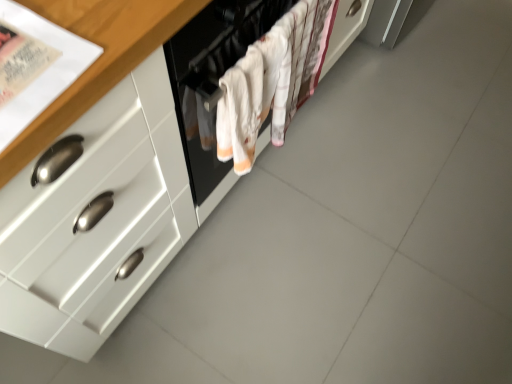
Question: Is white fabric oven at center spatially inside white glossy cabinet at center, or outside of it?

Choices:
 (A) outside
 (B) inside

Answer: (A)

Question: From their relative heights in the image, would you say white fabric oven at center is taller or shorter than white glossy cabinet at center?

Choices:
 (A) tall
 (B) short

Answer: (B)

Question: Considering their positions, is white fabric oven at center located in front of or behind white glossy cabinet at center?

Choices:
 (A) behind
 (B) front

Answer: (A)

Question: Considering the positions of point coord(66,205) and point coord(176,48), is point coord(66,205) closer or farther from the camera than point coord(176,48)?

Choices:
 (A) closer
 (B) farther

Answer: (A)

Question: Is white glossy cabinet at center wider or thinner than white fabric oven at center?

Choices:
 (A) thin
 (B) wide

Answer: (B)

Question: Considering their positions, is white glossy cabinet at center located in front of or behind white fabric oven at center?

Choices:
 (A) behind
 (B) front

Answer: (B)

Question: Is white glossy cabinet at center bigger or smaller than white fabric oven at center?

Choices:
 (A) small
 (B) big

Answer: (B)